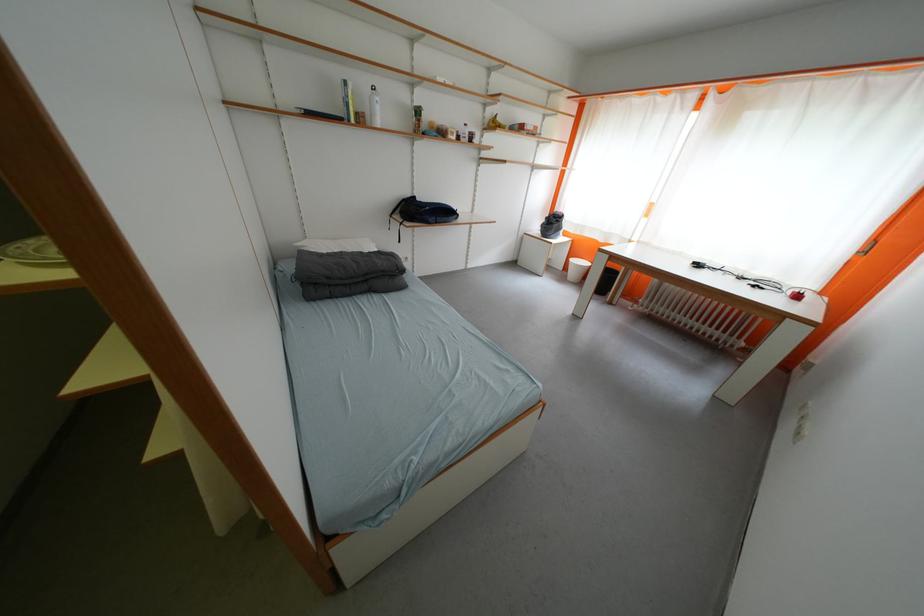
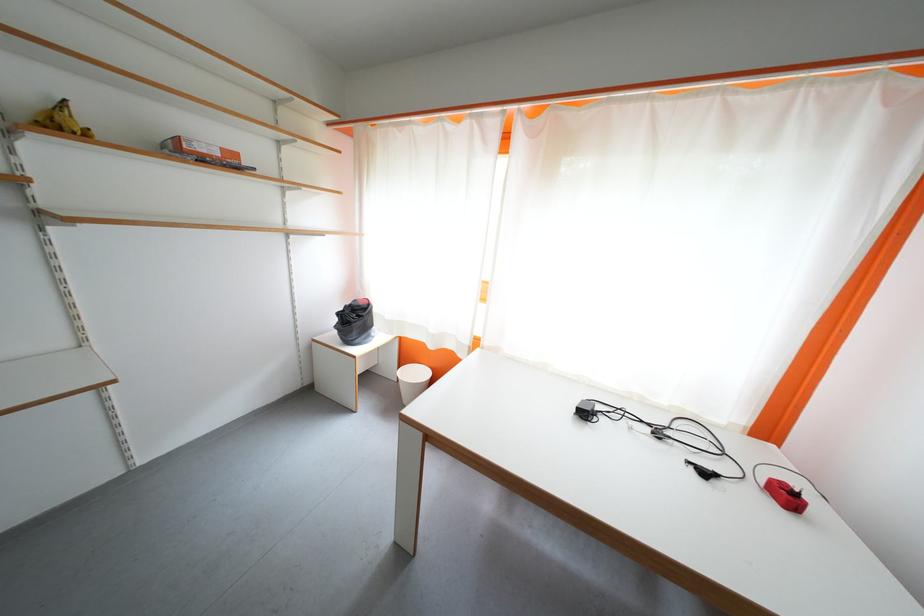
Locate, in the second image, the point that corresponds to the point at 806,300 in the first image.

(796, 500)